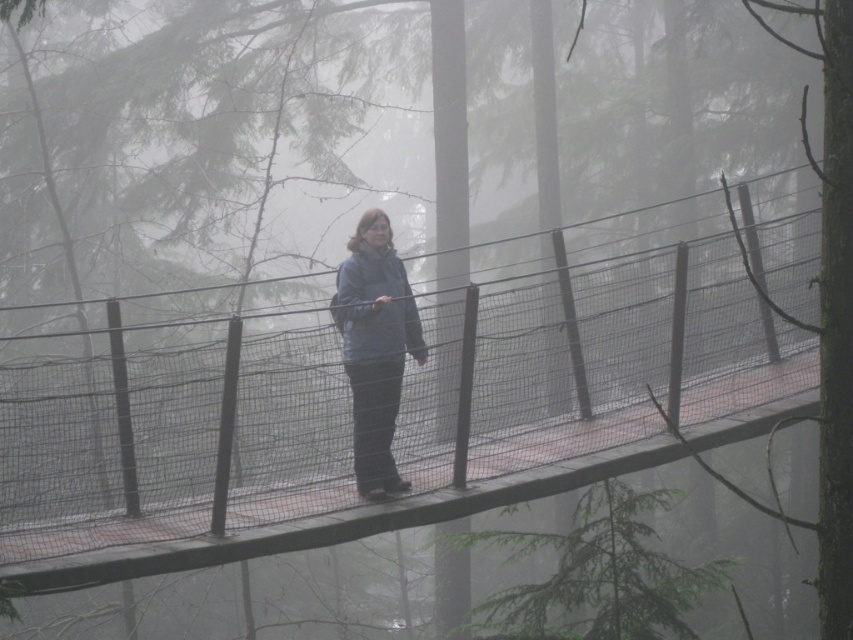
Question: Which of the following is the closest to the observer?

Choices:
 (A) (375, 285)
 (B) (602, 380)

Answer: (A)

Question: Among these objects, which one is farthest from the camera?

Choices:
 (A) wooden at center
 (B) blue matte jacket at center

Answer: (A)

Question: Is wooden at center below blue matte jacket at center?

Choices:
 (A) yes
 (B) no

Answer: (B)

Question: From the image, what is the correct spatial relationship of wooden at center in relation to blue matte jacket at center?

Choices:
 (A) right
 (B) left

Answer: (A)

Question: Is wooden at center above blue matte jacket at center?

Choices:
 (A) no
 (B) yes

Answer: (B)